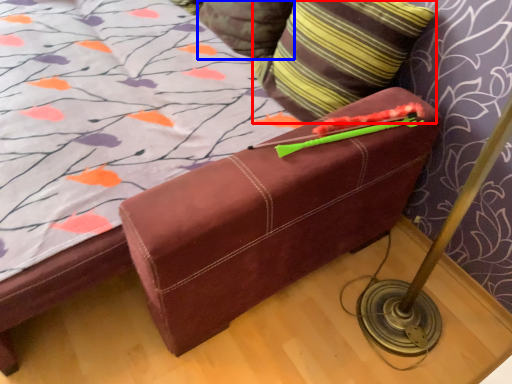
Question: Which point is closer to the camera, pillow (highlighted by a red box) or pillow (highlighted by a blue box)?

Choices:
 (A) pillow
 (B) pillow

Answer: (A)